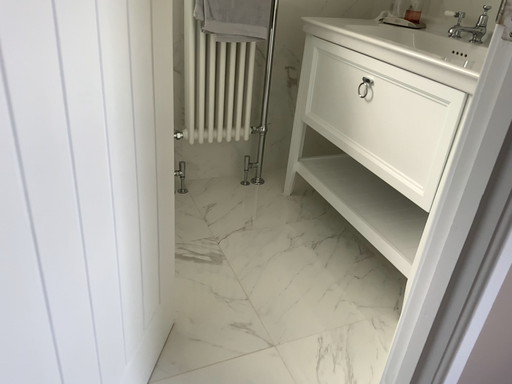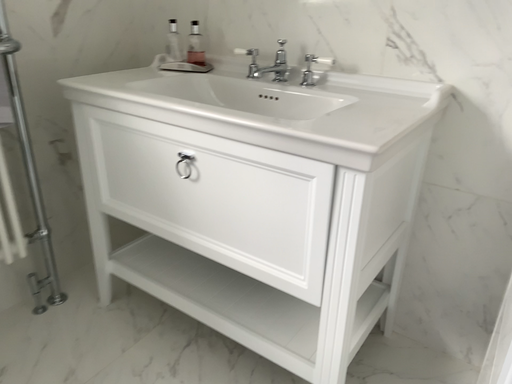
Question: Which way did the camera rotate in the video?

Choices:
 (A) rotated left
 (B) rotated right

Answer: (B)